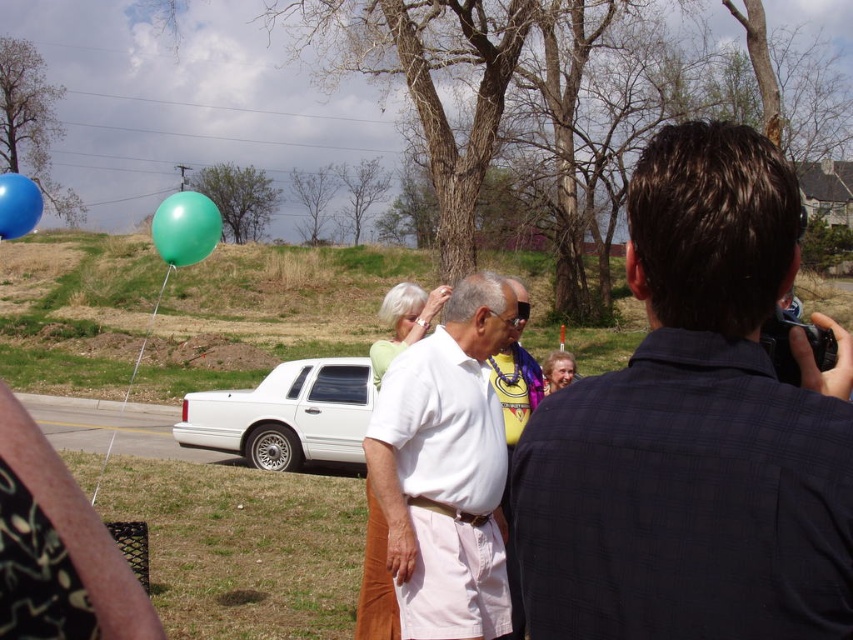
You are standing at point (589, 579) in the scene. You want to take a photo of the group of four people in the midground. The camera is at a certain location. Can you reach the camera from your current position without moving past the white sedan in the background?

The point (589, 579) and camera are 5.27 feet apart. Since the distance is manageable and the white sedan is in the background, you can likely reach the camera without moving past the sedan.

You are a photographer at the event and want to capture a photo of the dark blue shirt at center and the white glossy sedan at center. Which object is narrower in the image?

The dark blue shirt at center is thinner than the white glossy sedan at center, so the dark blue shirt at center is narrower.

You are standing at the center of the image. There is a point at coordinate [445,468]. What object is located at that point?

The white cotton shirt at center is located at point [445,468].